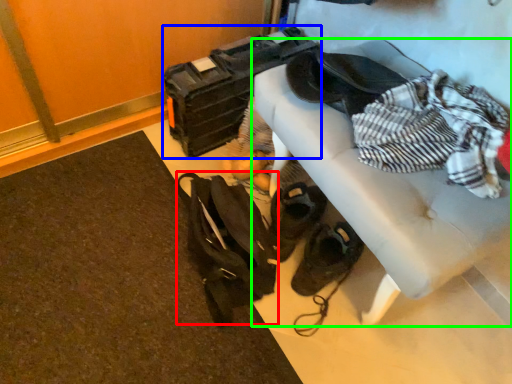
Question: Considering the real-world distances, which object is closest to messenger bag (highlighted by a red box)? luggage (highlighted by a blue box) or furniture (highlighted by a green box).

Choices:
 (A) luggage
 (B) furniture

Answer: (B)